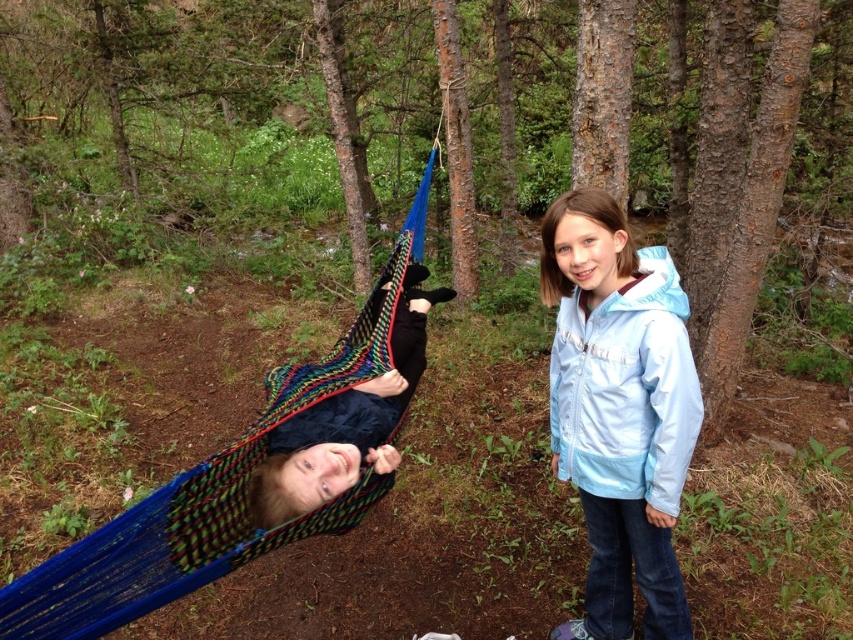
Based on the photo, who is higher up, light blue fabric jacket at center or smooth bark tree at center?

smooth bark tree at center is higher up.

Between light blue fabric jacket at center and smooth bark tree at center, which one appears on the left side from the viewer's perspective?

Positioned to the left is smooth bark tree at center.

Measure the distance between point (676,301) and camera.

The distance of point (676,301) from camera is 2.48 meters.

Locate an element on the screen. The image size is (853, 640). light blue fabric jacket at center is located at coordinates (619, 410).

Is point (775, 52) less distant than point (451, 269)?

Yes, it is in front of point (451, 269).

How distant is brown rough bark tree at center right from smooth bark tree at center?

They are 8.65 feet apart.

Find the location of `brown rough bark tree at center right`. brown rough bark tree at center right is located at coordinates (738, 186).

Does multicolored knitted hammock at center have a greater width compared to brown rough bark at upper center?

Indeed, multicolored knitted hammock at center has a greater width compared to brown rough bark at upper center.

Is multicolored knitted hammock at center below brown rough bark at upper center?

Indeed, multicolored knitted hammock at center is positioned under brown rough bark at upper center.

The height and width of the screenshot is (640, 853). Find the location of `multicolored knitted hammock at center`. multicolored knitted hammock at center is located at coordinates (344, 422).